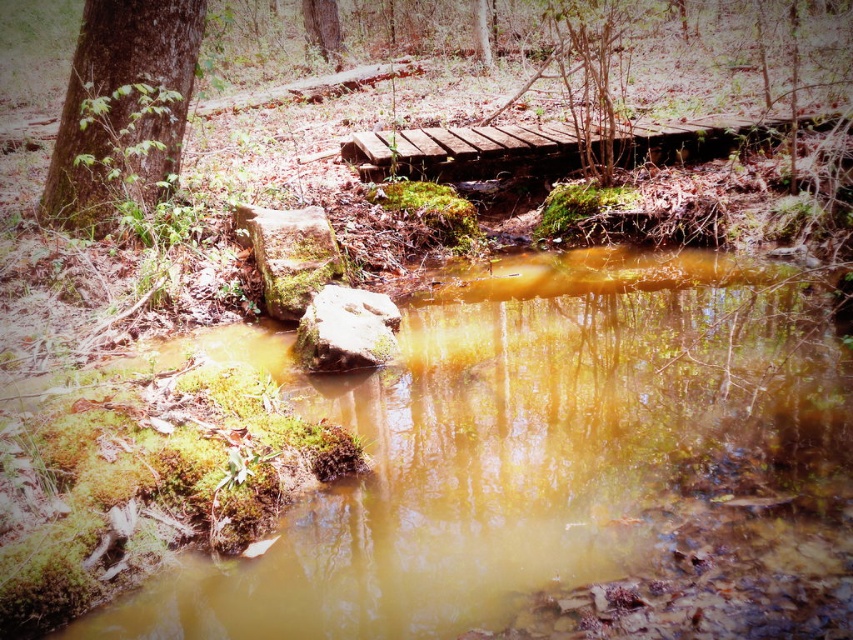
You are a hiker carrying a backpack weighing 20 kilograms. You want to cross the stream using the rustic wooden bridge at center. Considering the bridge is 5.96 meters away from you, is it within your reach to safely walk to the bridge without getting your backpack wet?

The rustic wooden bridge at center is 5.96 meters away from the viewer. Since the distance is manageable for a hiker to walk, you can safely reach the bridge without getting your backpack wet as long as you follow proper caution.

You are standing at the edge of the stream in the forest scene. You notice a green mossy rock at center left. If you walk directly toward the point marked at coordinates (289, 253), will you reach the green mossy rock at center left?

Yes, the point marked at coordinates (289, 253) corresponds to the green mossy rock at center left, so walking directly toward that point will lead you to the green mossy rock at center left.